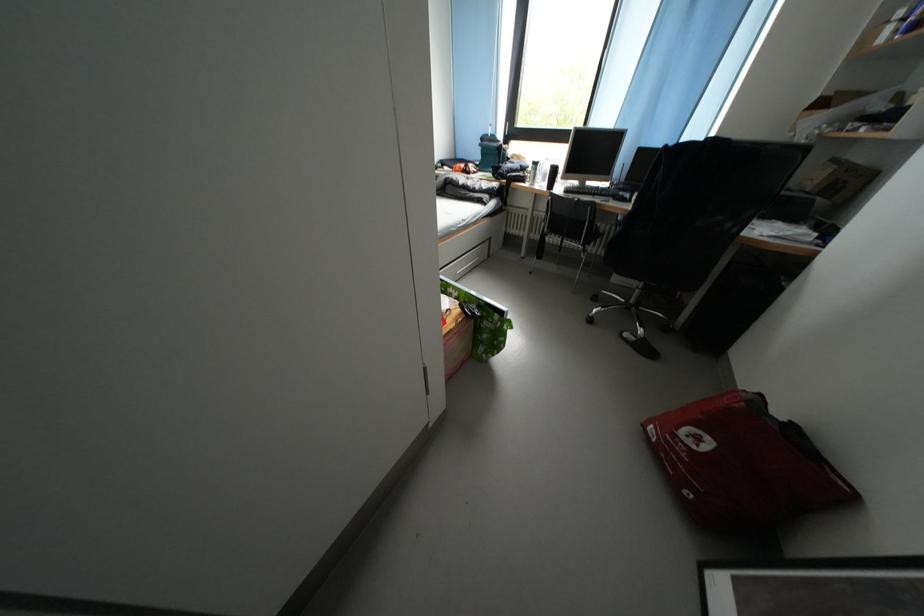
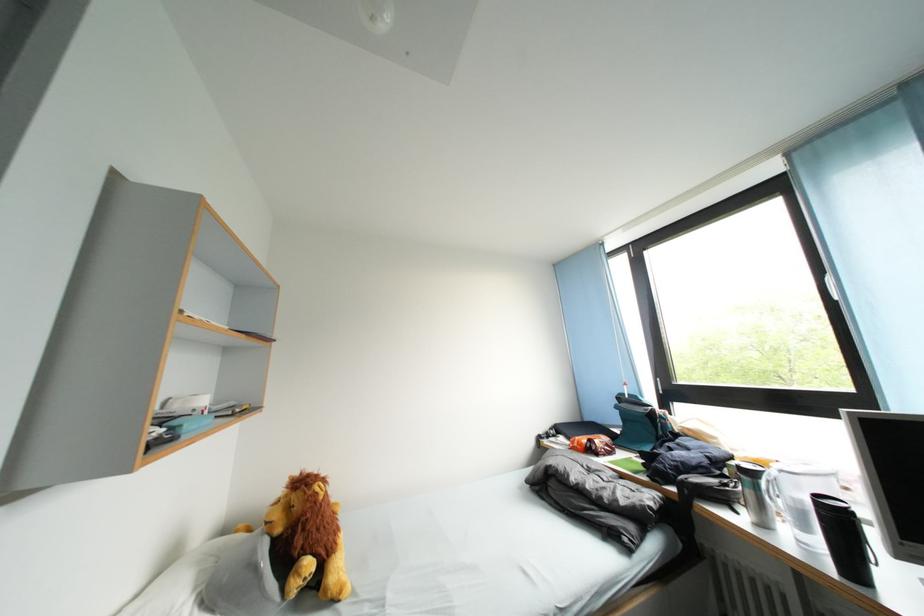
The point at (563, 175) is marked in the first image. Where is the corresponding point in the second image?

(844, 522)